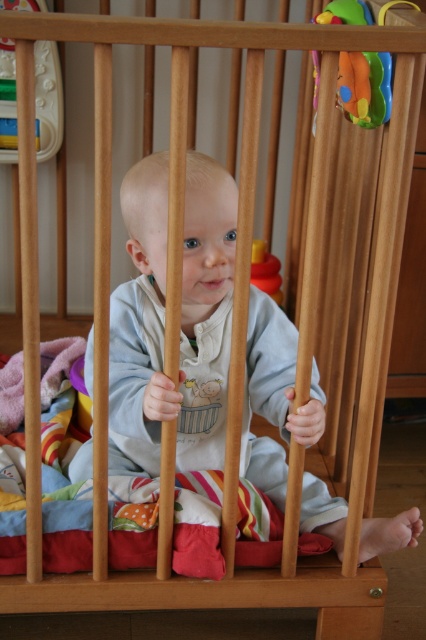
Does rubberized plastic rattle at upper left appear over rubberized yellow toy at center?

Yes, rubberized plastic rattle at upper left is above rubberized yellow toy at center.

Measure the distance between rubberized plastic rattle at upper left and camera.

rubberized plastic rattle at upper left is 5.05 feet away from camera.

Locate an element on the screen. The height and width of the screenshot is (640, 426). rubberized plastic rattle at upper left is located at coordinates (48, 97).

Does plastic colorful rattle at upper right appear over rubberized plastic rattle at upper left?

Incorrect, plastic colorful rattle at upper right is not positioned above rubberized plastic rattle at upper left.

Does plastic colorful rattle at upper right come in front of rubberized plastic rattle at upper left?

Yes, it is in front of rubberized plastic rattle at upper left.

Which is in front, point (331, 17) or point (9, 77)?

Point (331, 17) is more forward.

At what (x,y) coordinates should I click in order to perform the action: click on plastic colorful rattle at upper right. Please return your answer as a coordinate pair (x, y). This screenshot has width=426, height=640. Looking at the image, I should click on (365, 88).

Who is lower down, plastic colorful rattle at upper right or rubberized yellow toy at center?

rubberized yellow toy at center

Is point (368, 12) closer to viewer compared to point (253, 273)?

That is True.

Image resolution: width=426 pixels, height=640 pixels. Describe the element at coordinates (365, 88) in the screenshot. I see `plastic colorful rattle at upper right` at that location.

Where is `plastic colorful rattle at upper right`? The height and width of the screenshot is (640, 426). plastic colorful rattle at upper right is located at coordinates (365, 88).